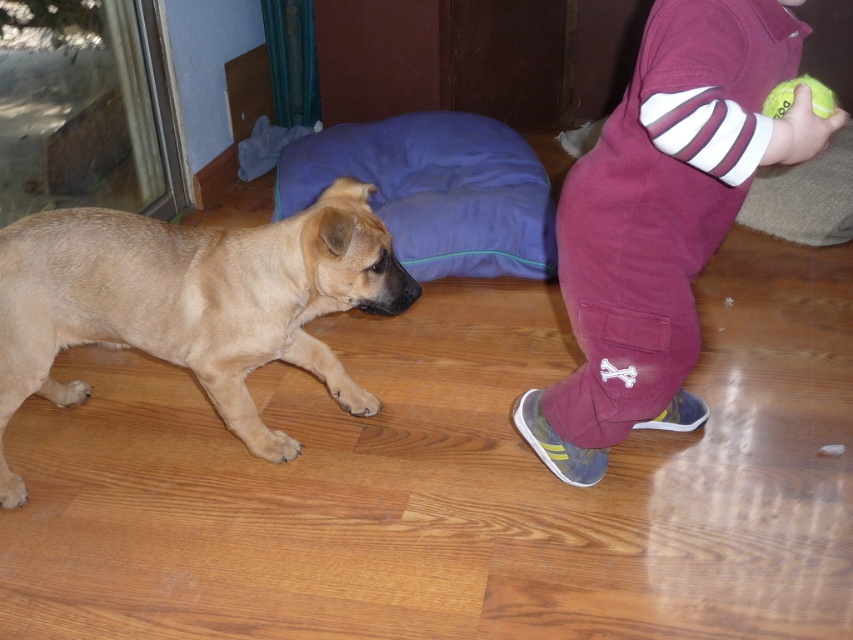
Between maroon cotton pants at right and light brown fur at left, which one has less height?

light brown fur at left

You are a GUI agent. You are given a task and a screenshot of the screen. Output one action in this format:
    pyautogui.click(x=<x>, y=<y>)
    Task: Click on the maroon cotton pants at right
    
    Given the screenshot: What is the action you would take?
    pyautogui.click(x=662, y=220)

Locate an element on the screen. The image size is (853, 640). light brown fur at left is located at coordinates (192, 301).

From the picture: Which is more to the right, light brown fur at left or purple fabric pillow at center?

purple fabric pillow at center is more to the right.

Image resolution: width=853 pixels, height=640 pixels. Find the location of `light brown fur at left`. light brown fur at left is located at coordinates (x=192, y=301).

Does light brown fur at left have a greater height compared to yellow rubber tennis ball at lower right?

Correct, light brown fur at left is much taller as yellow rubber tennis ball at lower right.

Which is in front, point (42, 296) or point (802, 83)?

Positioned in front is point (802, 83).

The height and width of the screenshot is (640, 853). What are the coordinates of `light brown fur at left` in the screenshot? It's located at (192, 301).